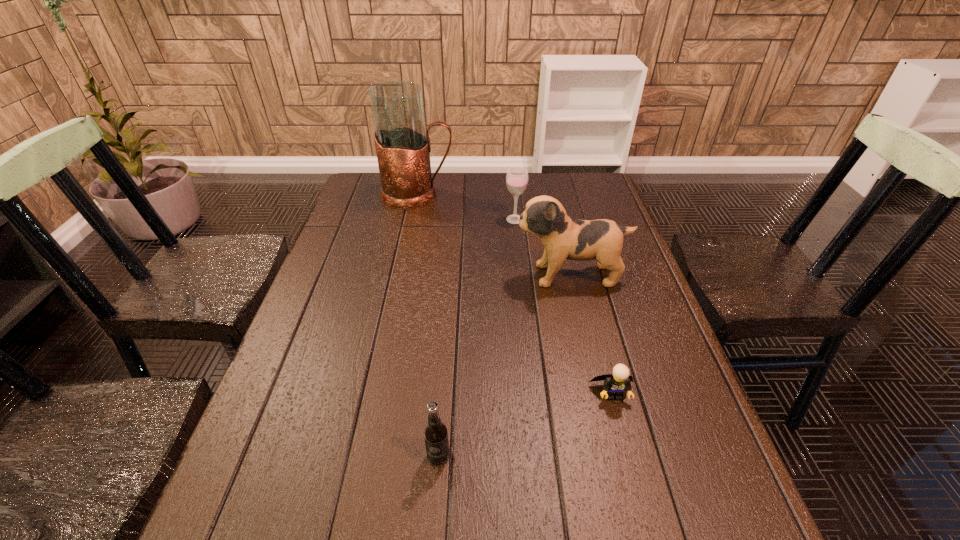
Image resolution: width=960 pixels, height=540 pixels. In order to click on the farthest object in this screenshot , I will do `click(403, 147)`.

Find the location of `pitcher`. pitcher is located at coordinates (403, 147).

At what (x,y) coordinates should I click in order to perform the action: click on puppy. Please return your answer as a coordinate pair (x, y). Image resolution: width=960 pixels, height=540 pixels. Looking at the image, I should click on (563, 238).

Locate an element on the screen. The height and width of the screenshot is (540, 960). the fourth shortest object is located at coordinates (563, 238).

Where is `wineglass`? The width and height of the screenshot is (960, 540). wineglass is located at coordinates (517, 177).

At what (x,y) coordinates should I click in order to perform the action: click on root beer. Please return your answer as a coordinate pair (x, y). This screenshot has width=960, height=540. Looking at the image, I should click on (435, 433).

This screenshot has width=960, height=540. I want to click on the fourth farthest object, so click(616, 384).

Locate an element on the screen. This screenshot has height=540, width=960. the shortest object is located at coordinates (616, 384).

This screenshot has height=540, width=960. In order to click on free space located 0.160m with the handle on the side of the pitcher in this screenshot , I will do `click(501, 195)`.

At what (x,y) coordinates should I click in order to perform the action: click on vacant space located at the face of the third farthest object. Please return your answer as a coordinate pair (x, y). Looking at the image, I should click on (464, 275).